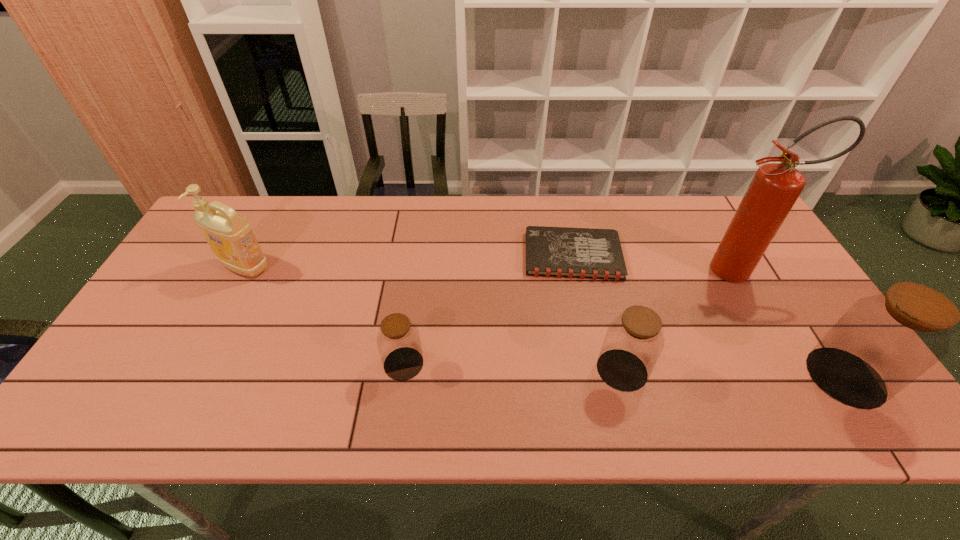
Considering the uniform spacing of jars, where should an additional jar be positioned on the left? Please locate a free spot. Please provide its 2D coordinates. Your answer should be formatted as a tuple, i.e. [(x, y)], where the tuple contains the x and y coordinates of a point satisfying the conditions above.

[(190, 357)]